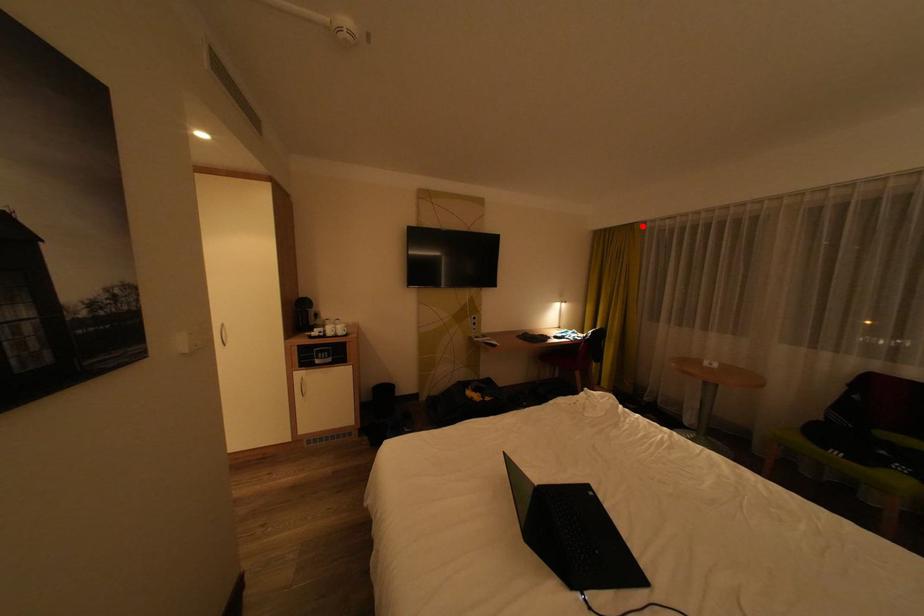
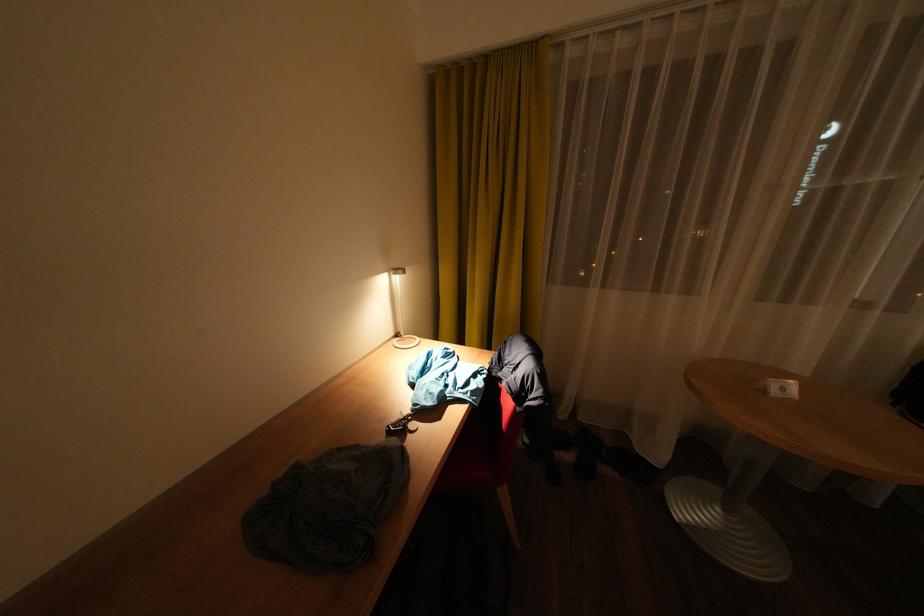
Find the pixel in the second image that matches the highlighted location in the first image.

(544, 47)